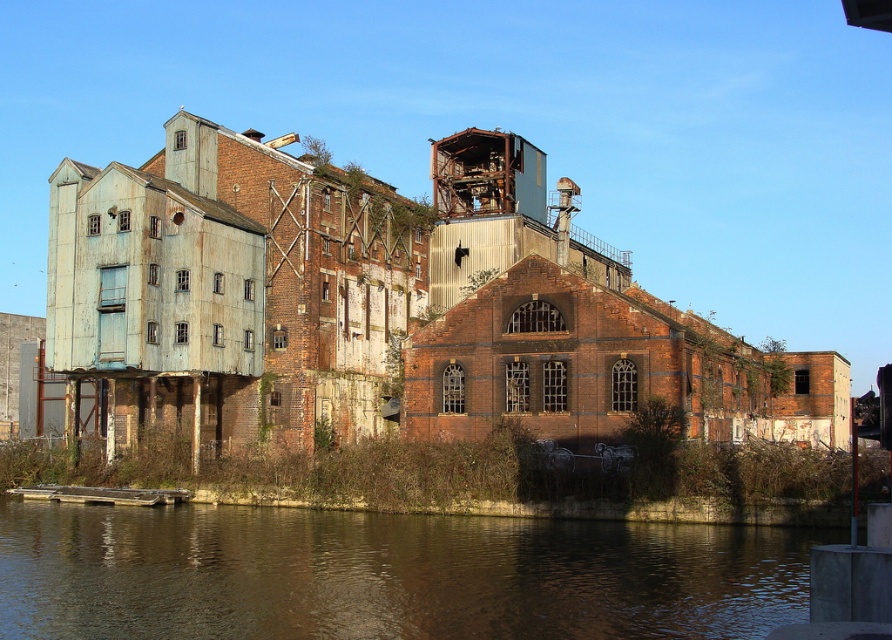
You are standing at the point closest to the water in the image. You see two points marked in the scene. Which point is farther away from you? The points are labeled as point 1 at coordinates point (448, 387) and point 2 at coordinates point (266, 570). Please choose between point 1 or point 2.

Point 1 at coordinates point (448, 387) is farther away from you because it is behind point 2 at coordinates point (266, 570).

You are standing on the dock and want to take a photo of the rusty metal building at left and the brown reflective water at lower left. Which object should you focus on first if you want to capture both in a single frame without moving your camera?

You should focus on the rusty metal building at left first because the brown reflective water at lower left is behind it, so adjusting the focus to the foreground object will ensure both are in the frame.

You are a photographer planning to capture the rusty metal building at left and the brown reflective water at lower left in a single shot. Based on their sizes, which object should you focus on to ensure both are clearly visible in the frame?

The rusty metal building at left is bigger than the brown reflective water at lower left, so focusing on the larger rusty metal building at left will help ensure both objects are visible in the frame.